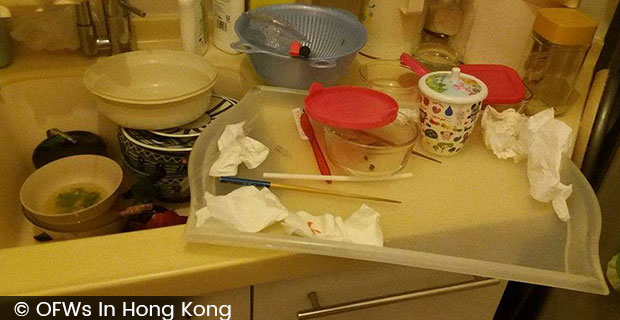
The width and height of the screenshot is (620, 320). What are the coordinates of `plastic cover` in the screenshot? It's located at click(525, 242).